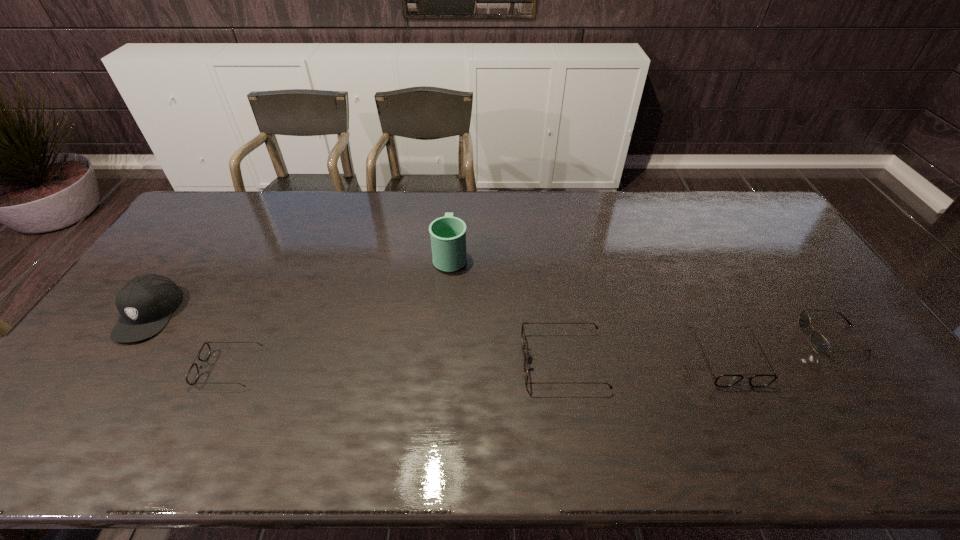
I want to click on vacant space located on the front-facing side of the leftmost sunglasses, so click(x=129, y=368).

Find the location of a particular element. free location located 0.080m on the front-facing side of the leftmost sunglasses is located at coordinates (172, 368).

The width and height of the screenshot is (960, 540). What are the coordinates of `free space located on the front-facing side of the leftmost sunglasses` in the screenshot? It's located at click(x=94, y=368).

Where is `vacant space located on the front-facing side of the third object from right to left`? Image resolution: width=960 pixels, height=540 pixels. vacant space located on the front-facing side of the third object from right to left is located at coordinates (443, 361).

At what (x,y) coordinates should I click in order to perform the action: click on free location located on the front-facing side of the third object from right to left. Please return your answer as a coordinate pair (x, y). Image resolution: width=960 pixels, height=540 pixels. Looking at the image, I should click on (489, 361).

The image size is (960, 540). I want to click on vacant area situated on the front-facing side of the third object from right to left, so click(x=374, y=361).

The height and width of the screenshot is (540, 960). What are the coordinates of `vacant area situated on the front-facing side of the third sunglasses from left to right` in the screenshot? It's located at (749, 406).

You are a GUI agent. You are given a task and a screenshot of the screen. Output one action in this format:
    pyautogui.click(x=<x>, y=<y>)
    Task: Click on the free space located on the front-facing side of the leftmost object
    
    Given the screenshot: What is the action you would take?
    pyautogui.click(x=90, y=399)

Where is `vacant space situated on the front-facing side of the rightmost object`? This screenshot has width=960, height=540. vacant space situated on the front-facing side of the rightmost object is located at coordinates (705, 338).

Locate an element on the screen. The width and height of the screenshot is (960, 540). vacant position located 0.050m on the front-facing side of the rightmost object is located at coordinates (785, 338).